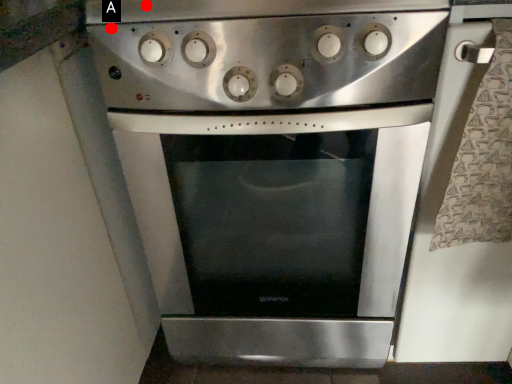
Question: Two points are circled on the image, labeled by A and B beside each circle. Which point is further to the camera?

Choices:
 (A) A is further
 (B) B is further

Answer: (A)